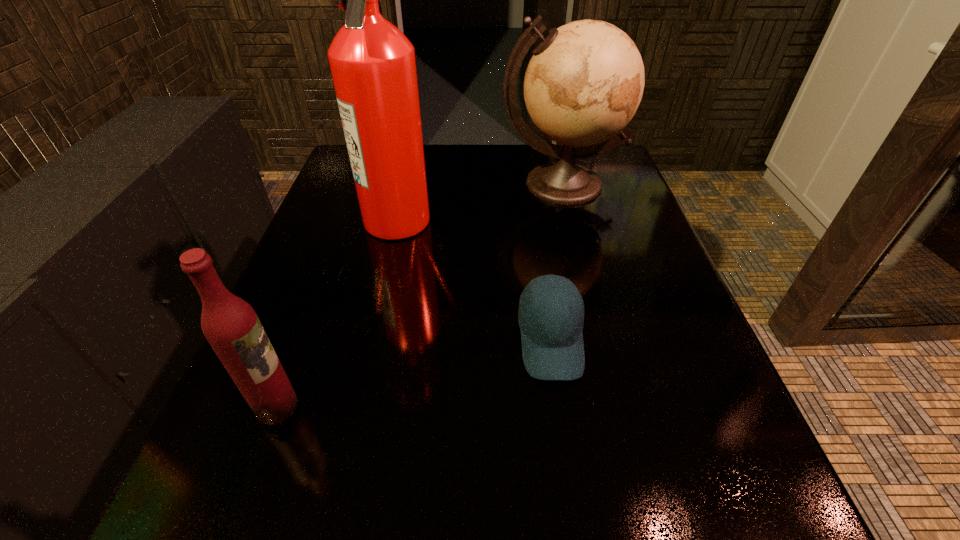
Find the location of a particular element. The height and width of the screenshot is (540, 960). free region located on the front-facing side of the baseball cap is located at coordinates (572, 487).

I want to click on object positioned at the far edge, so click(584, 82).

The width and height of the screenshot is (960, 540). I want to click on fire extinguisher at the left edge, so (x=373, y=67).

Locate an element on the screen. The width and height of the screenshot is (960, 540). liquor positioned at the left edge is located at coordinates (231, 326).

I want to click on object that is positioned at the right edge, so click(x=584, y=82).

Locate an element on the screen. Image resolution: width=960 pixels, height=540 pixels. object that is at the far right corner is located at coordinates (584, 82).

In the image, there is a desktop. Identify the location of free space at the far edge. (453, 180).

Where is `vacant space at the left edge`? The width and height of the screenshot is (960, 540). vacant space at the left edge is located at coordinates (234, 429).

At what (x,y) coordinates should I click in order to perform the action: click on free space at the right edge of the desktop. Please return your answer as a coordinate pair (x, y). The height and width of the screenshot is (540, 960). Looking at the image, I should click on [x=633, y=255].

The width and height of the screenshot is (960, 540). In the image, there is a desktop. What are the coordinates of `vacant space at the far left corner` in the screenshot? It's located at (343, 154).